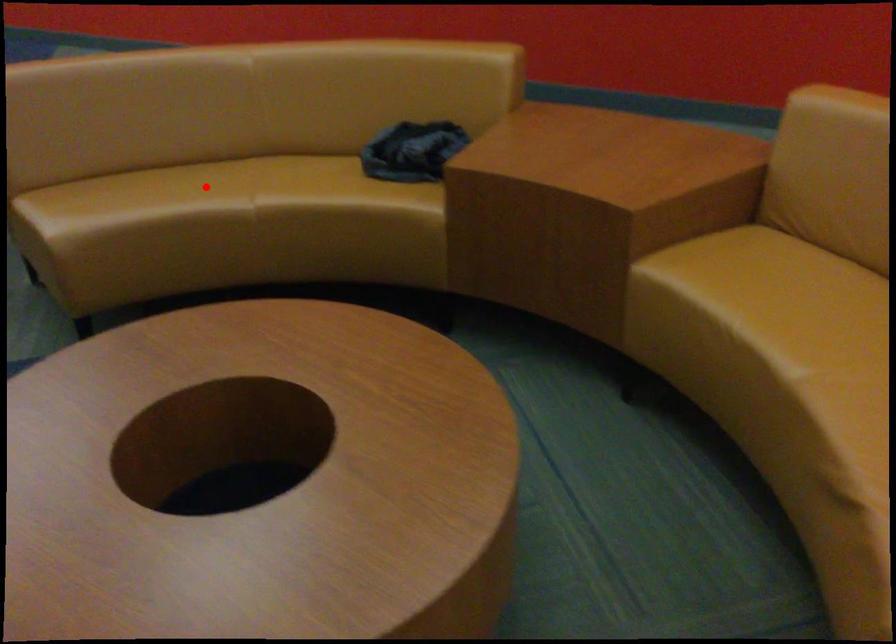
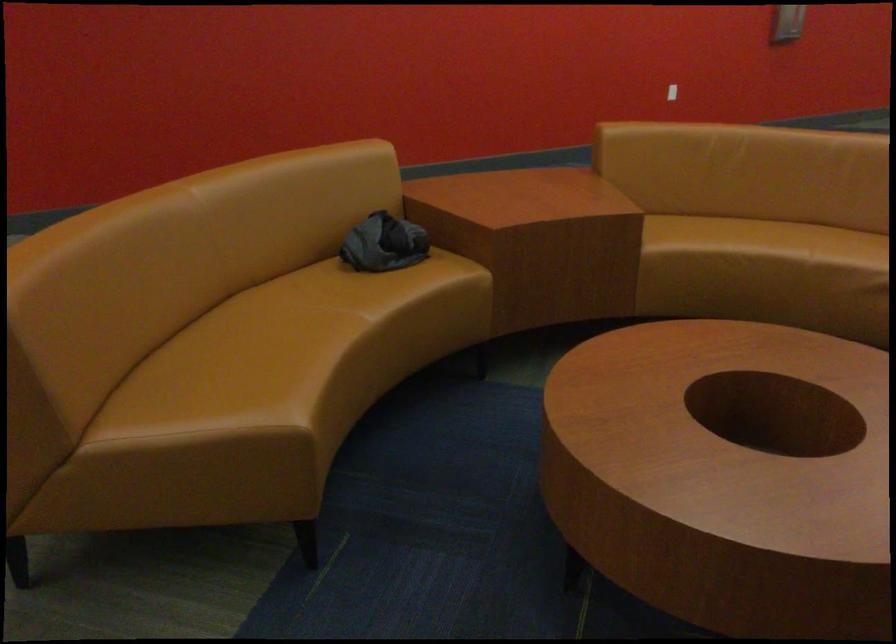
In the second image, find the point that corresponds to the highlighted location in the first image.

(271, 336)